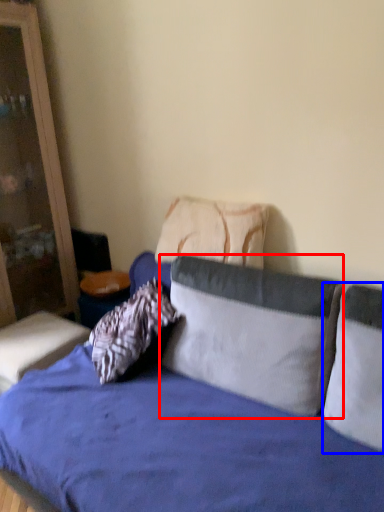
Question: Which object is further to the camera taking this photo, pillow (highlighted by a red box) or pillow (highlighted by a blue box)?

Choices:
 (A) pillow
 (B) pillow

Answer: (A)